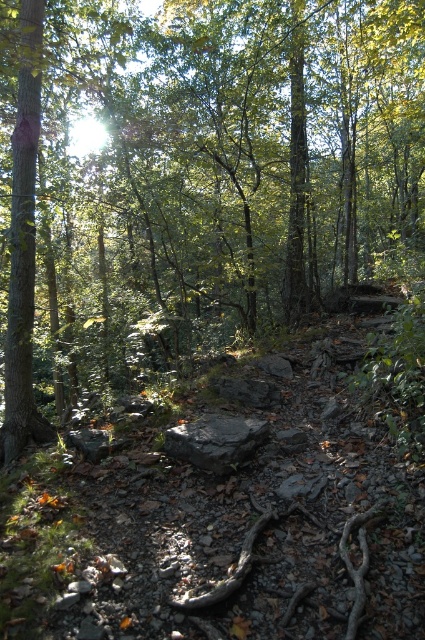
Which is behind, point (278, 140) or point (234, 448)?

The point (278, 140) is more distant.

Does green leafy tree at center appear on the right side of black rock at center?

Incorrect, green leafy tree at center is not on the right side of black rock at center.

In order to click on green leafy tree at center in this screenshot , I will do `click(227, 172)`.

This screenshot has height=640, width=425. I want to click on green leafy tree at center, so click(227, 172).